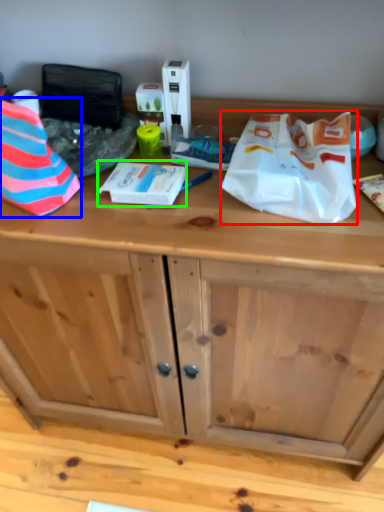
Question: Which object is the closest to the wrapping paper (highlighted by a red box)? Choose among these: wrapping paper (highlighted by a blue box) or wrapping paper (highlighted by a green box).

Choices:
 (A) wrapping paper
 (B) wrapping paper

Answer: (B)